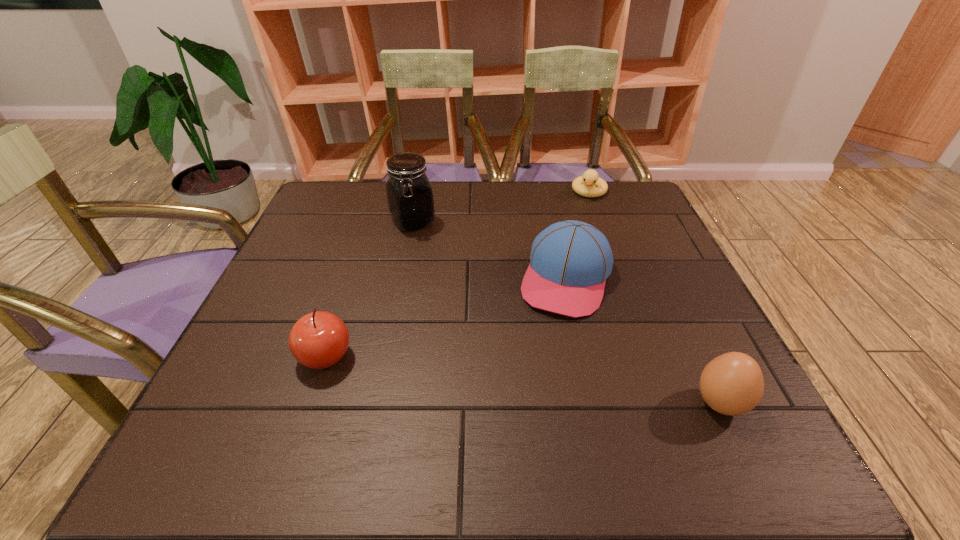
I want to click on vacant space at the right edge of the desktop, so click(x=677, y=284).

This screenshot has width=960, height=540. In the image, there is a desktop. What are the coordinates of `free space at the far left corner` in the screenshot? It's located at (x=315, y=209).

This screenshot has height=540, width=960. In order to click on vacant space at the near left corner of the desktop in this screenshot , I will do `click(263, 398)`.

The image size is (960, 540). In the image, there is a desktop. Identify the location of vacant space at the near right corner. (682, 412).

Find the location of a particular element. free space that is in between the boiled egg and the baseball cap is located at coordinates (643, 341).

You are a GUI agent. You are given a task and a screenshot of the screen. Output one action in this format:
    pyautogui.click(x=<x>, y=<y>)
    Task: Click on the vacant area between the nearest object and the farthest object
    
    Given the screenshot: What is the action you would take?
    pyautogui.click(x=655, y=298)

Image resolution: width=960 pixels, height=540 pixels. What are the coordinates of `vacant space that's between the duckling and the apple` in the screenshot? It's located at (457, 274).

Find the location of `free spot between the third farthest object and the boiled egg`. free spot between the third farthest object and the boiled egg is located at coordinates (643, 341).

I want to click on vacant space that's between the fourth nearest object and the third farthest object, so (490, 251).

Image resolution: width=960 pixels, height=540 pixels. I want to click on unoccupied position between the apple and the shortest object, so click(x=457, y=274).